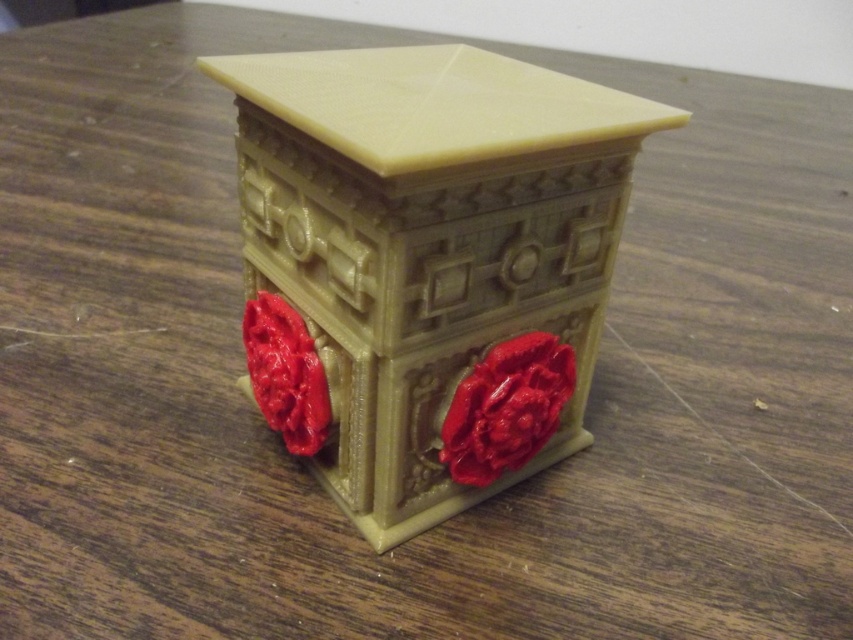
Can you confirm if matte beige cabinet at center is taller than matte plastic flower at center?

Yes.

From the picture: Who is positioned more to the right, matte beige cabinet at center or matte plastic flower at center?

matte beige cabinet at center is more to the right.

Locate an element on the screen. matte beige cabinet at center is located at coordinates (432, 259).

Looking at this image, is matte red flower at lower right smaller than matte plastic flower at center?

Yes.

Between point (474, 440) and point (244, 316), which one is positioned in front?

Point (474, 440) is more forward.

Which is behind, point (498, 452) or point (264, 374)?

Point (264, 374)

Where is `matte red flower at lower right`? matte red flower at lower right is located at coordinates (506, 406).

Which is more to the left, matte beige cabinet at center or matte red flower at lower right?

Positioned to the left is matte beige cabinet at center.

Is matte beige cabinet at center in front of matte red flower at lower right?

Yes, it is.

Is point (372, 426) farther from camera compared to point (524, 433)?

No, it is in front of (524, 433).

Locate an element on the screen. The image size is (853, 640). matte beige cabinet at center is located at coordinates (432, 259).